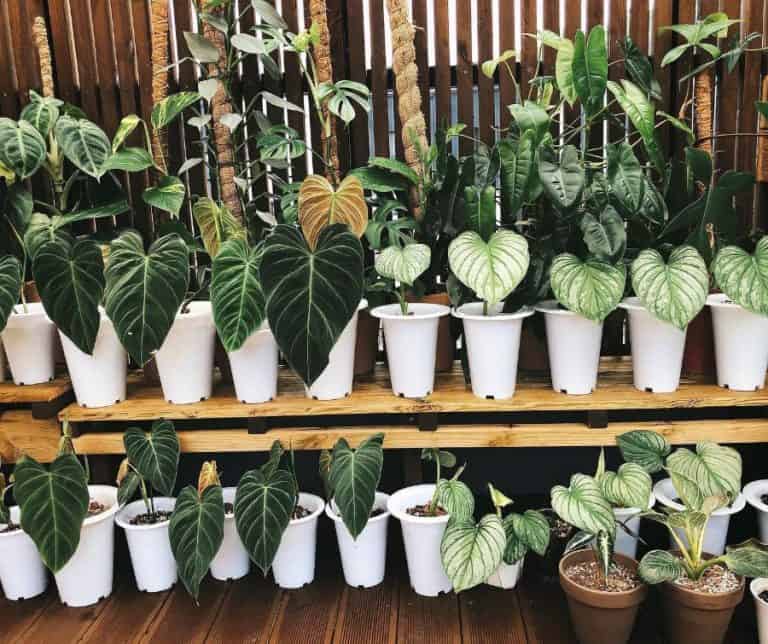
The width and height of the screenshot is (768, 644). Find the location of `pot`. pot is located at coordinates (654, 359).